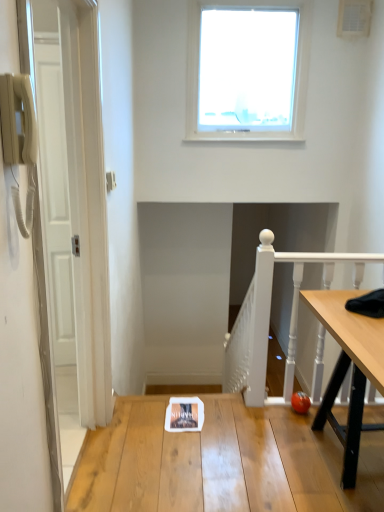
What do you see at coordinates (269, 319) in the screenshot?
I see `white painted wood at right` at bounding box center [269, 319].

This screenshot has height=512, width=384. What do you see at coordinates (294, 70) in the screenshot?
I see `transparent glass window at upper center` at bounding box center [294, 70].

At what (x,y) coordinates should I click in order to perform the action: click on wooden table at center. Please return your answer as a coordinate pair (x, y). The height and width of the screenshot is (512, 384). Looking at the image, I should click on pyautogui.click(x=222, y=462).

What is the approximate height of wooden table at center?

3.89 inches.

Identify the location of white painted wood at right. (269, 319).

Is white painted wood at right at the back of transparent glass window at upper center?

No.

Is transparent glass window at upper center taller than white painted wood at right?

Indeed, transparent glass window at upper center has a greater height compared to white painted wood at right.

Considering the relative sizes of transparent glass window at upper center and white painted wood at right in the image provided, is transparent glass window at upper center wider than white painted wood at right?

Correct, the width of transparent glass window at upper center exceeds that of white painted wood at right.

Is white painted wood at right at the left side of wooden table at center?

In fact, white painted wood at right is to the right of wooden table at center.

In the scene shown: Does white painted wood at right have a greater width compared to wooden table at center?

Incorrect, the width of white painted wood at right does not surpass that of wooden table at center.

How many degrees apart are the facing directions of white painted wood at right and wooden table at center?

white painted wood at right and wooden table at center are facing 178 degrees away from each other.

Where is `table that appears in front of the white painted wood at right`? This screenshot has width=384, height=512. table that appears in front of the white painted wood at right is located at coordinates (222, 462).

This screenshot has height=512, width=384. Find the location of `window above the white painted wood at right (from the image's perspective)`. window above the white painted wood at right (from the image's perspective) is located at coordinates (x=294, y=70).

Can you confirm if white painted wood at right is positioned to the right of transparent glass window at upper center?

Correct, you'll find white painted wood at right to the right of transparent glass window at upper center.

Is white painted wood at right looking in the opposite direction of transparent glass window at upper center?

No, white painted wood at right is not facing the opposite direction of transparent glass window at upper center.

Is white painted wood at right inside the boundaries of transparent glass window at upper center, or outside?

white painted wood at right lies outside transparent glass window at upper center.

From the image's perspective, is transparent glass window at upper center on top of wooden table at center?

Yes, from the image's perspective, transparent glass window at upper center is over wooden table at center.

Is point (193, 106) positioned before point (152, 441)?

No, it is not.

This screenshot has height=512, width=384. I want to click on window on the right of the wooden table at center, so click(x=294, y=70).

Considering the sizes of objects transparent glass window at upper center and wooden table at center in the image provided, who is bigger, transparent glass window at upper center or wooden table at center?

With larger size is transparent glass window at upper center.

Is wooden table at center bigger or smaller than white painted wood at right?

wooden table at center is bigger than white painted wood at right.

From the image's perspective, which one is positioned higher, wooden table at center or white painted wood at right?

white painted wood at right.

Can you confirm if wooden table at center is wider than white painted wood at right?

Correct, the width of wooden table at center exceeds that of white painted wood at right.

From a real-world perspective, is wooden table at center positioned over white painted wood at right based on gravity?

Incorrect, from a real-world perspective, wooden table at center is lower than white painted wood at right.

Does wooden table at center have a lesser height compared to transparent glass window at upper center?

Indeed, wooden table at center has a lesser height compared to transparent glass window at upper center.

Is transparent glass window at upper center at the back of wooden table at center?

No, wooden table at center's orientation is not away from transparent glass window at upper center.

Which is more to the left, wooden table at center or transparent glass window at upper center?

Positioned to the left is wooden table at center.

You are a GUI agent. You are given a task and a screenshot of the screen. Output one action in this format:
    pyautogui.click(x=<x>, y=<y>)
    Task: Click on the rail that is below the transparent glass window at upper center (from the image's perspective)
    The width and height of the screenshot is (384, 512).
    Given the screenshot: What is the action you would take?
    pyautogui.click(x=269, y=319)

You are a GUI agent. You are given a task and a screenshot of the screen. Output one action in this format:
    pyautogui.click(x=<x>, y=<y>)
    Task: Click on the table below the white painted wood at right (from a real-world perspective)
    This screenshot has width=384, height=512.
    Given the screenshot: What is the action you would take?
    pyautogui.click(x=222, y=462)

Which object lies further to the anchor point transparent glass window at upper center, wooden table at center or white painted wood at right?

wooden table at center.

From the image, which object appears to be nearer to white painted wood at right, wooden table at center or transparent glass window at upper center?

wooden table at center.

When comparing their distances from white painted wood at right, does transparent glass window at upper center or wooden table at center seem further?

transparent glass window at upper center.

When comparing their distances from wooden table at center, does white painted wood at right or transparent glass window at upper center seem closer?

white painted wood at right lies closer to wooden table at center than the other object.

From the image, which object appears to be nearer to transparent glass window at upper center, white painted wood at right or wooden table at center?

white painted wood at right is positioned closer to the anchor transparent glass window at upper center.

Consider the image. Looking at the image, which one is located closer to wooden table at center, transparent glass window at upper center or white painted wood at right?

Based on the image, white painted wood at right appears to be nearer to wooden table at center.

What are the coordinates of `rail between transparent glass window at upper center and wooden table at center vertically` in the screenshot? It's located at (269, 319).